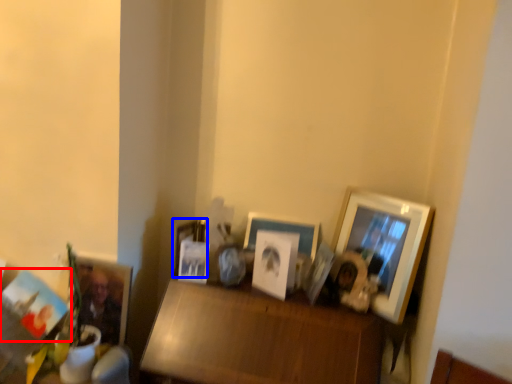
Question: Which object appears farthest to the camera in this image, picture frame (highlighted by a red box) or picture frame (highlighted by a blue box)?

Choices:
 (A) picture frame
 (B) picture frame

Answer: (B)